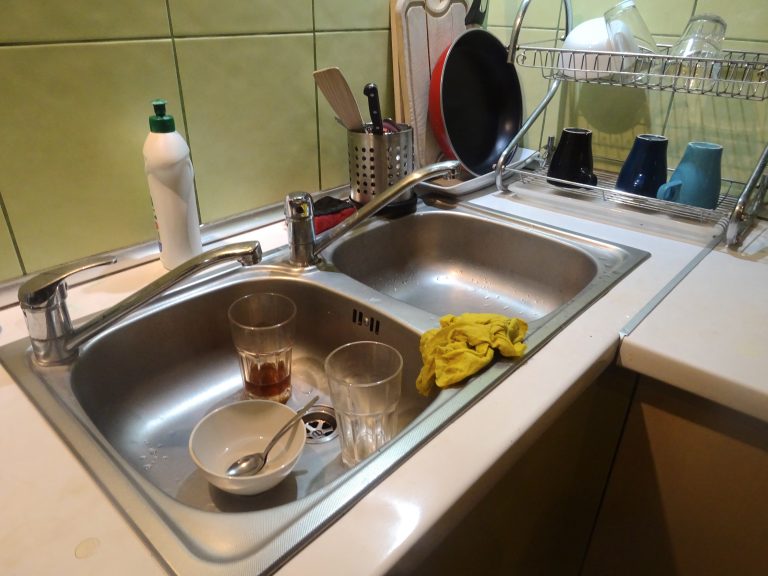
Where is `faucet`? The height and width of the screenshot is (576, 768). faucet is located at coordinates (68, 340), (309, 248).